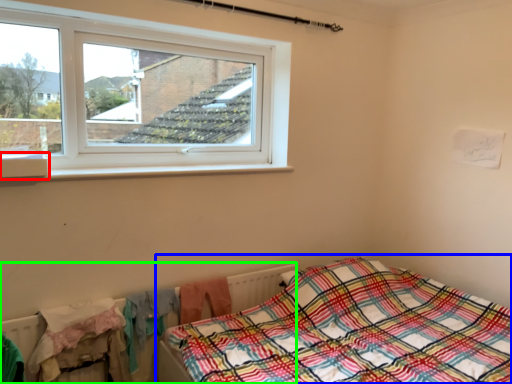
Question: Based on their relative distances, which object is farther from window sill (highlighted by a red box)? Choose from bed (highlighted by a blue box) and radiator (highlighted by a green box).

Choices:
 (A) bed
 (B) radiator

Answer: (A)